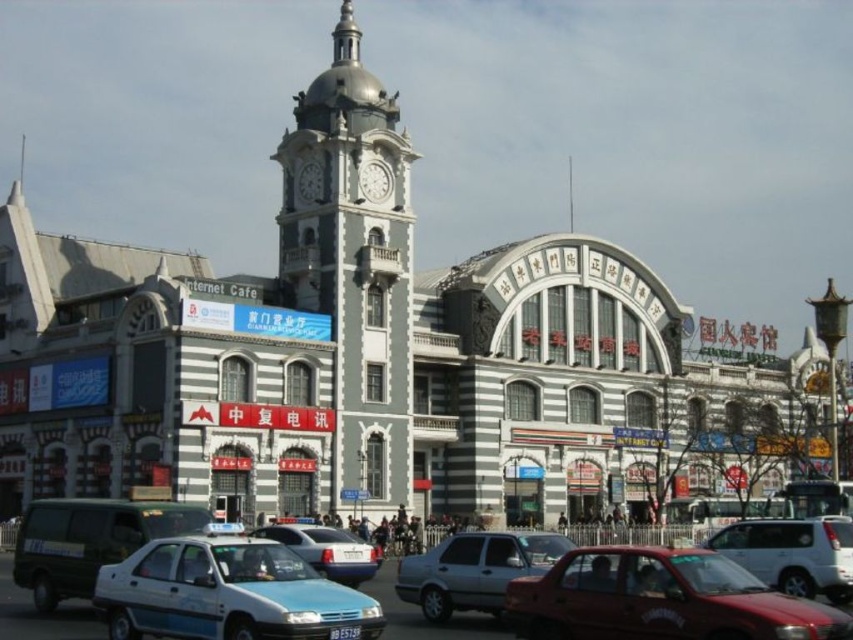
You are a city planner analyzing traffic flow. You need to know if the shiny red sedan at lower right can fit into a parking space designed for vehicles narrower than the white glossy clock at center. Can it fit?

The shiny red sedan at lower right is wider than the white glossy clock at center, so it cannot fit into a parking space designed for vehicles narrower than the white glossy clock at center.

You are a pedestrian standing at the crosswalk near the shiny red sedan at lower right. You want to reach the white glossy clock at center. Which direction should you walk to get closer to the clock?

The shiny red sedan at lower right is in front of the white glossy clock at center, so you should walk towards the direction away from the shiny red sedan at lower right to get closer to the white glossy clock at center.